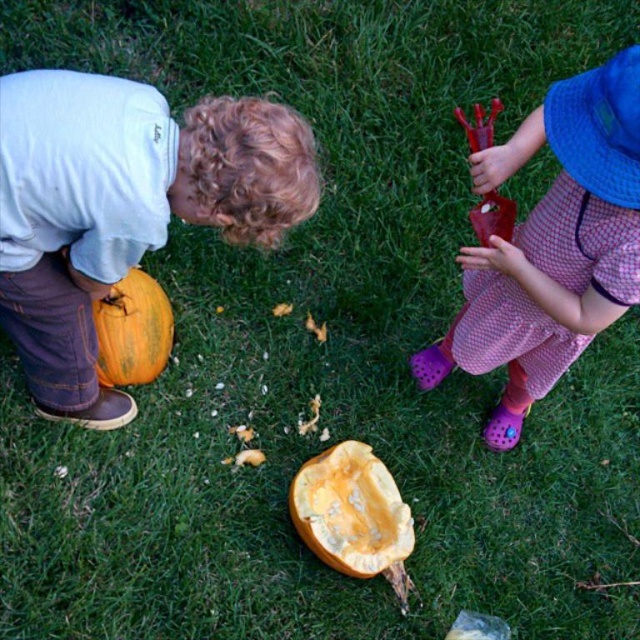
Question: Where is yellow matte pumpkin at center located in relation to orange matte pumpkin at lower left in the image?

Choices:
 (A) below
 (B) above

Answer: (A)

Question: Does matte orange pumpkin at left appear on the left side of orange matte pumpkin at lower left?

Choices:
 (A) no
 (B) yes

Answer: (A)

Question: Which point is farther from the camera taking this photo?

Choices:
 (A) (10, 202)
 (B) (113, 323)
 (C) (621, 141)
 (D) (372, 572)

Answer: (B)

Question: Which point is farther from the camera taking this photo?

Choices:
 (A) (305, 541)
 (B) (97, 372)
 (C) (308, 193)
 (D) (605, 77)

Answer: (A)

Question: Which point is farther to the camera?

Choices:
 (A) matte orange pumpkin at left
 (B) yellow matte pumpkin at center
 (C) rubberized plastic lobster at right

Answer: (B)

Question: Is yellow matte pumpkin at center closer to camera compared to orange matte pumpkin at lower left?

Choices:
 (A) no
 (B) yes

Answer: (A)